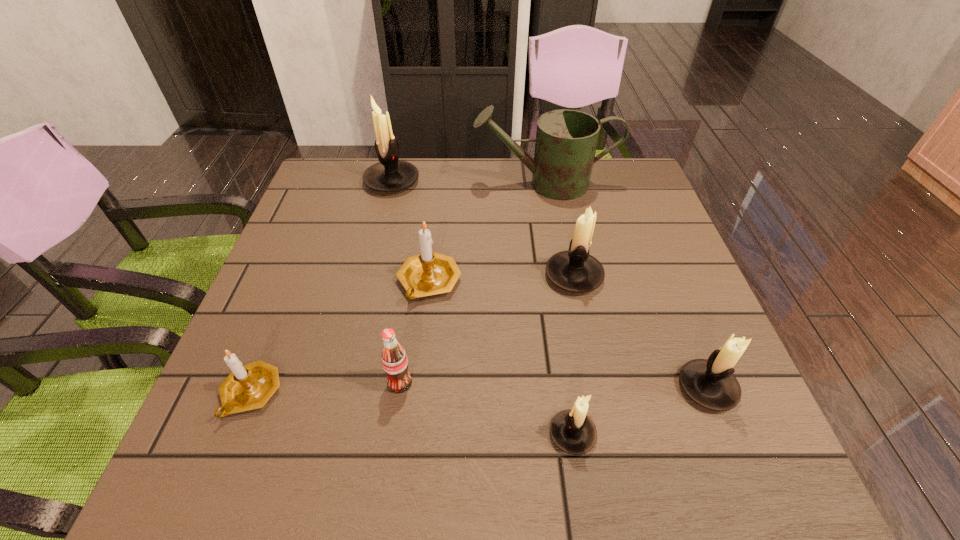
Where is `empty space that is in between the second smallest white candle holder and the right gold candle holder`? This screenshot has width=960, height=540. empty space that is in between the second smallest white candle holder and the right gold candle holder is located at coordinates (568, 335).

Where is `free spot between the rightmost candle holder and the smallest white candle holder`? free spot between the rightmost candle holder and the smallest white candle holder is located at coordinates (639, 411).

Image resolution: width=960 pixels, height=540 pixels. In order to click on vacant space in between the bigger gold candle holder and the rightmost candle holder in this screenshot , I will do `click(568, 335)`.

Identify the location of free space between the soda and the bigger gold candle holder. (415, 333).

Where is `free space that is in between the watering can and the bigger gold candle holder`? free space that is in between the watering can and the bigger gold candle holder is located at coordinates (487, 233).

At what (x,y) coordinates should I click in order to perform the action: click on unoccupied area between the tallest candle holder and the soda. Please return your answer as a coordinate pair (x, y). The image size is (960, 540). Looking at the image, I should click on (396, 282).

This screenshot has height=540, width=960. In order to click on free space between the right gold candle holder and the smallest white candle holder in this screenshot , I will do `click(501, 358)`.

Find the location of `unoccupied position between the soda and the smallest white candle holder`. unoccupied position between the soda and the smallest white candle holder is located at coordinates (486, 408).

Where is `object that can be found as the seventh closest to the smallest white candle holder`? This screenshot has height=540, width=960. object that can be found as the seventh closest to the smallest white candle holder is located at coordinates (390, 174).

Identify which object is the sixth closest to the green watering can. Please provide its 2D coordinates. Your answer should be formatted as a tuple, i.e. [(x, y)], where the tuple contains the x and y coordinates of a point satisfying the conditions above.

[(572, 431)]